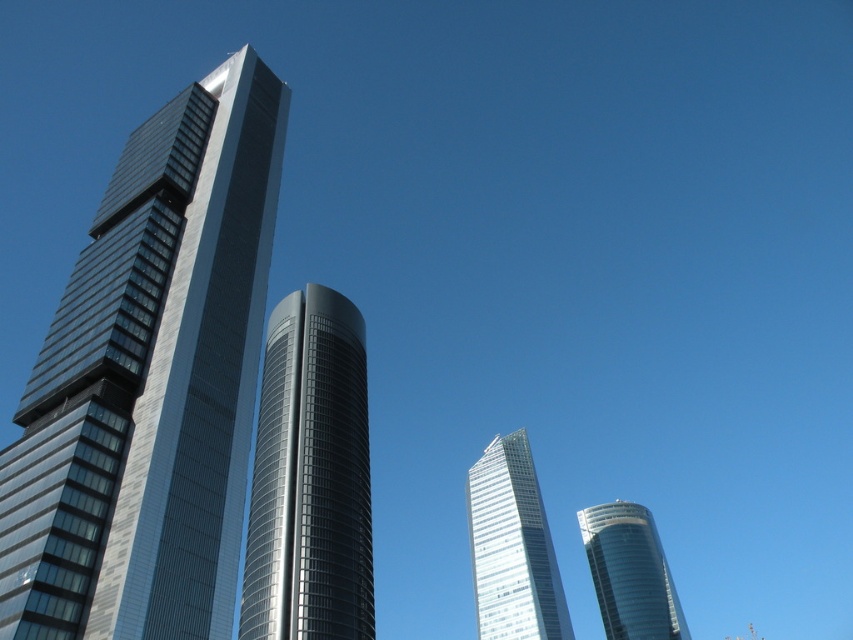
Does shiny glass skyscraper at left lie in front of shiny glass tower at lower right?

Yes, shiny glass skyscraper at left is in front of shiny glass tower at lower right.

Describe the element at coordinates (149, 381) in the screenshot. I see `shiny glass skyscraper at left` at that location.

Identify the location of shiny glass skyscraper at left. This screenshot has width=853, height=640. (149, 381).

Is point (175, 531) farther from camera compared to point (532, 616)?

No, it is not.

Is point (99, 243) less distant than point (520, 580)?

Yes, it is in front of point (520, 580).

Locate an element on the screen. The height and width of the screenshot is (640, 853). shiny glass skyscraper at left is located at coordinates (149, 381).

Locate an element on the screen. The height and width of the screenshot is (640, 853). shiny glass skyscraper at left is located at coordinates (149, 381).

From the picture: Can you confirm if glossy glass tower at center is positioned to the left of shiny glass tower at lower right?

Yes, glossy glass tower at center is to the left of shiny glass tower at lower right.

Does glossy glass tower at center lie behind shiny glass tower at lower right?

No, glossy glass tower at center is in front of shiny glass tower at lower right.

Which is in front, point (276, 394) or point (651, 545)?

Point (276, 394) is more forward.

At what (x,y) coordinates should I click in order to perform the action: click on glossy glass tower at center. Please return your answer as a coordinate pair (x, y). Image resolution: width=853 pixels, height=640 pixels. Looking at the image, I should click on (310, 477).